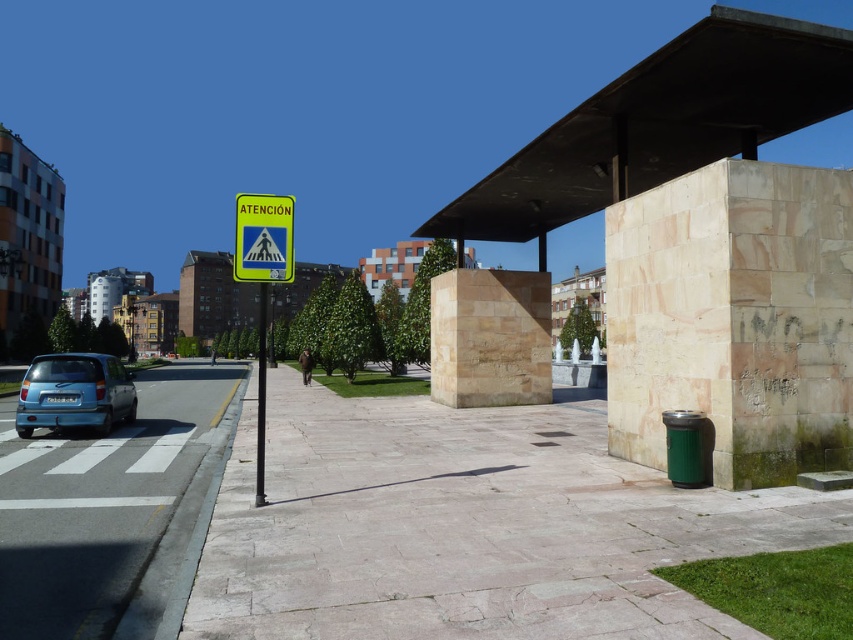
Question: Which of these objects is positioned closest to the beige stone bus stop at center?

Choices:
 (A) metallic pole at left
 (B) smooth concrete canopy at upper right

Answer: (B)

Question: Does pink stone pavement at center appear on the left side of smooth concrete canopy at upper right?

Choices:
 (A) yes
 (B) no

Answer: (A)

Question: Which of the following is the closest to the observer?

Choices:
 (A) metallic pole at left
 (B) beige stone pillar at center
 (C) beige stone bus stop at center
 (D) yellow reflective plastic sign at upper center

Answer: (D)

Question: Can you confirm if light blue plastic car at lower left is smaller than metallic pole at left?

Choices:
 (A) no
 (B) yes

Answer: (B)

Question: Which point is closer to the camera?

Choices:
 (A) (810, 40)
 (B) (503, 369)
 (C) (78, 387)
 (D) (250, 209)

Answer: (D)

Question: Is pink stone pavement at center closer to camera compared to yellow plastic sign at left?

Choices:
 (A) no
 (B) yes

Answer: (B)